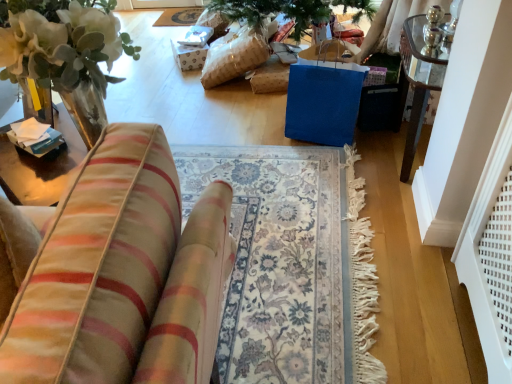
Question: From a real-world perspective, is velvet striped cushion at left above or below silky blue mat at upper center?

Choices:
 (A) below
 (B) above

Answer: (B)

Question: In terms of height, does velvet striped cushion at left look taller or shorter compared to silky blue mat at upper center?

Choices:
 (A) tall
 (B) short

Answer: (A)

Question: In the image, is velvet striped cushion at left on the left side or the right side of silky blue mat at upper center?

Choices:
 (A) right
 (B) left

Answer: (A)

Question: Considering the positions of point (180, 14) and point (155, 155), is point (180, 14) closer or farther from the camera than point (155, 155)?

Choices:
 (A) farther
 (B) closer

Answer: (A)

Question: Considering the relative positions of silky blue mat at upper center and velvet striped cushion at left in the image provided, is silky blue mat at upper center to the left or to the right of velvet striped cushion at left?

Choices:
 (A) left
 (B) right

Answer: (A)

Question: From the image's perspective, is silky blue mat at upper center positioned above or below velvet striped cushion at left?

Choices:
 (A) above
 (B) below

Answer: (A)

Question: Relative to velvet striped cushion at left, is silky blue mat at upper center in front or behind?

Choices:
 (A) front
 (B) behind

Answer: (B)